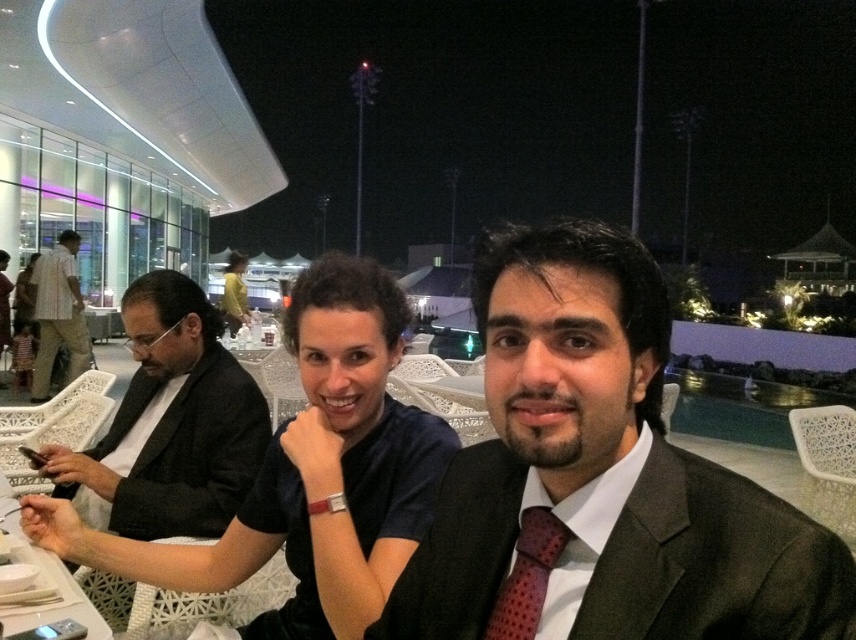
Question: Based on their relative distances, which object is farther from the polka dot silk tie at center?

Choices:
 (A) matte black suit at left
 (B) matte black suit at center

Answer: (A)

Question: Is polka dot silk tie at center further to camera compared to white plastic table at lower left?

Choices:
 (A) no
 (B) yes

Answer: (A)

Question: Does matte black suit at left appear on the left side of polka dot silk tie at center?

Choices:
 (A) no
 (B) yes

Answer: (B)

Question: Which of these objects is positioned farthest from the black matte suit at left?

Choices:
 (A) white plastic table at lower left
 (B) polka dot silk tie at center
 (C) matte black suit at left

Answer: (C)

Question: Which of these objects is positioned farthest from the matte black suit at left?

Choices:
 (A) white plastic table at lower left
 (B) matte black suit at center
 (C) polka dot silk tie at center
 (D) black matte suit at left

Answer: (C)

Question: Is black matte suit at left below polka dot silk tie at center?

Choices:
 (A) no
 (B) yes

Answer: (B)